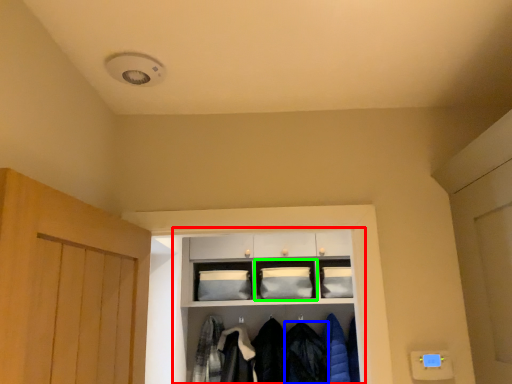
Question: Considering the real-world distances, which object is closest to shelf (highlighted by a red box)? clothing (highlighted by a blue box) or shelf (highlighted by a green box).

Choices:
 (A) clothing
 (B) shelf

Answer: (B)